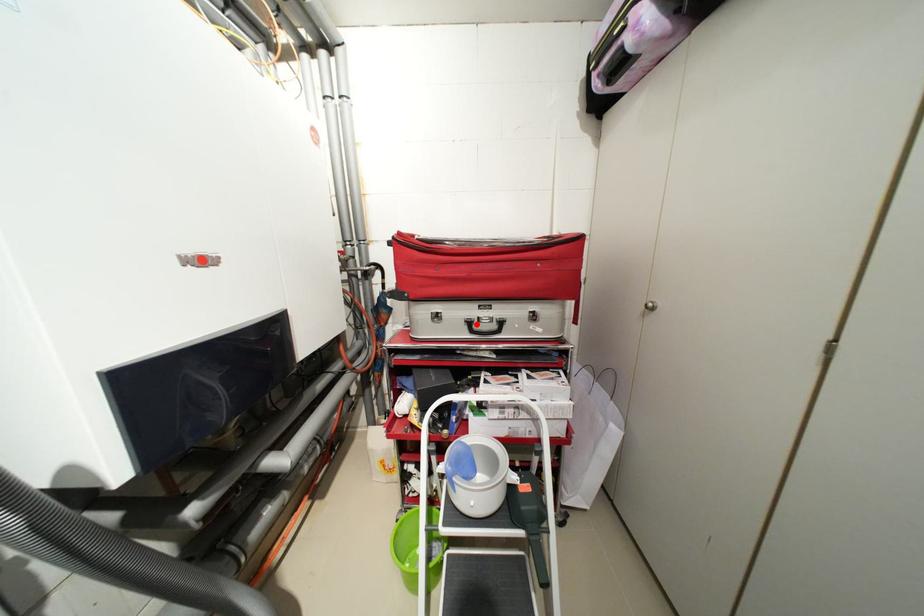
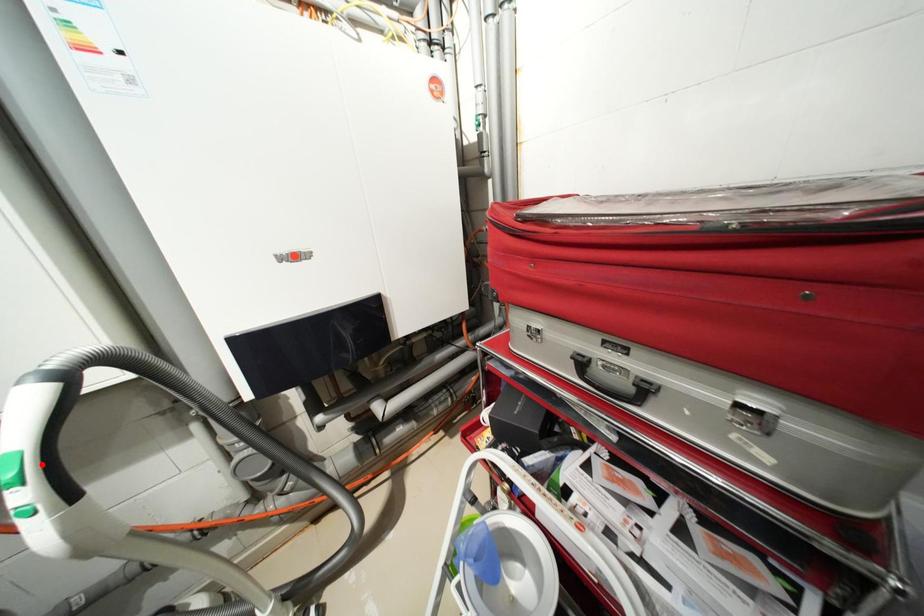
I am providing you with two images of the same scene from different viewpoints. A red point is marked on the first image and another point is marked on the second image. Are the points marked in image1 and image2 representing the same 3D position?

No